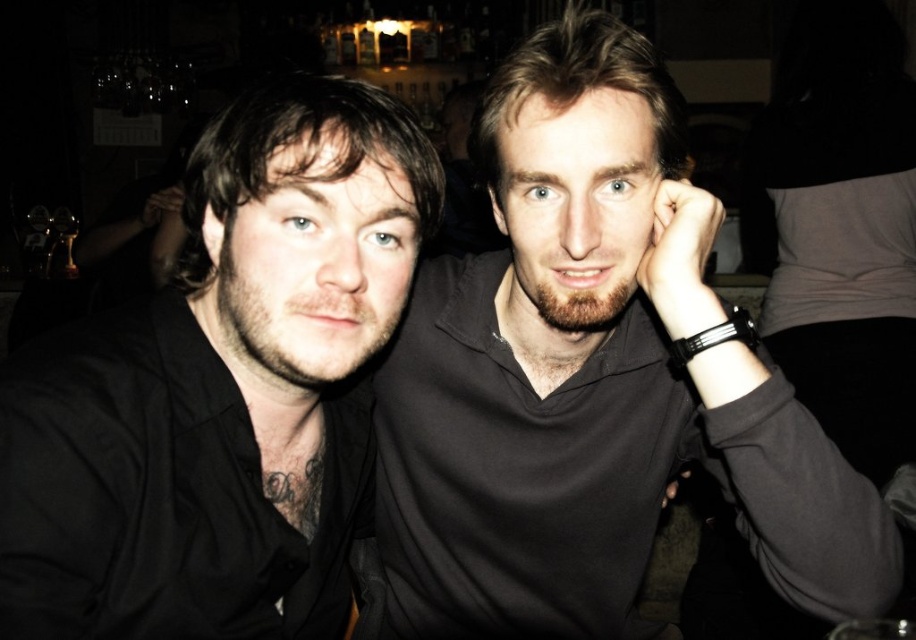
Which is in front, point (574, 369) or point (129, 608)?

Point (129, 608) is more forward.

From the picture: Who is positioned more to the left, matte black shirt at center or matte black shirt at left?

Positioned to the left is matte black shirt at left.

Which is in front, point (415, 308) or point (155, 305)?

Point (155, 305)

In order to click on matte black shirt at center in this screenshot , I will do `click(593, 380)`.